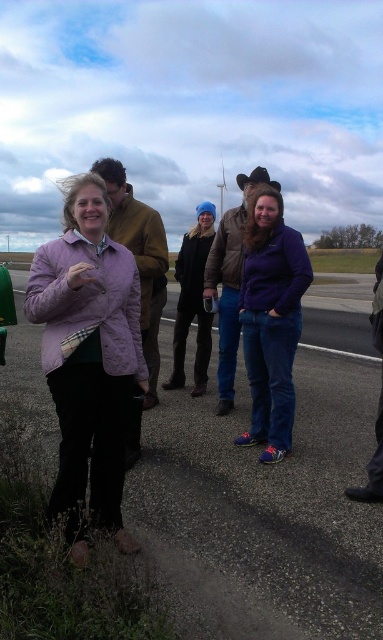
You are a delivery person who needs to cross the smooth asphalt road at center while avoiding the matte purple jacket at center. What is the minimum distance you need to move sideways to safely pass around it?

The smooth asphalt road at center and matte purple jacket at center are 1.65 meters apart from each other. To safely pass around the matte purple jacket at center, you need to move sideways at least 1.65 meters away from it.

You are a delivery person trying to cross the smooth asphalt road at center while avoiding the purple matte jacket at center. Is the road long enough to cross without stepping on the jacket?

The smooth asphalt road at center is shorter than purple matte jacket at center, so the road may not be long enough to cross without stepping on the jacket.

You are a delivery person who needs to place a package on the ground near the matte purple jacket at center. Can you place the package on the smooth asphalt road at center without it rolling away?

The smooth asphalt road at center is positioned under the matte purple jacket at center, so yes, you can place the package on the smooth asphalt road at center since it is directly beneath the jacket and provides a stable surface.